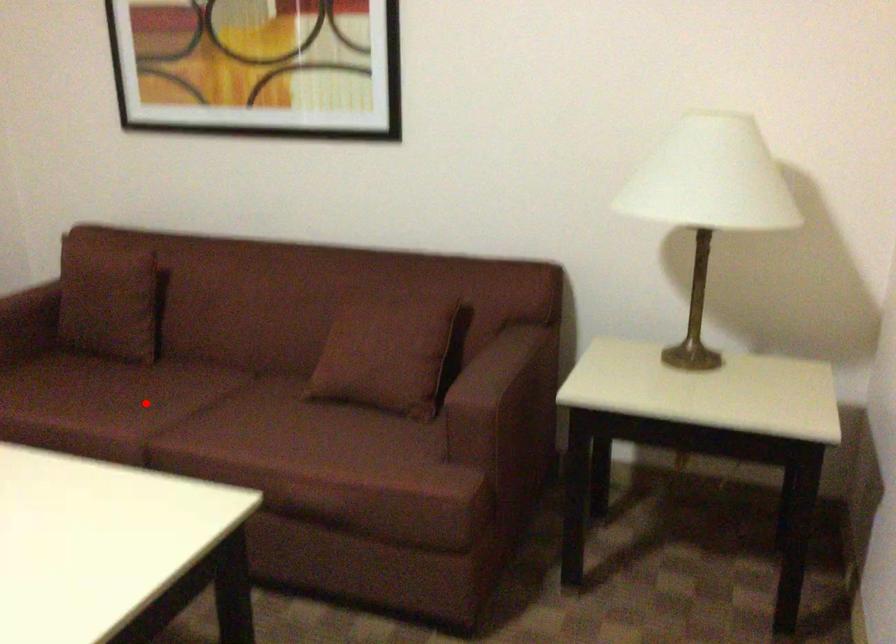
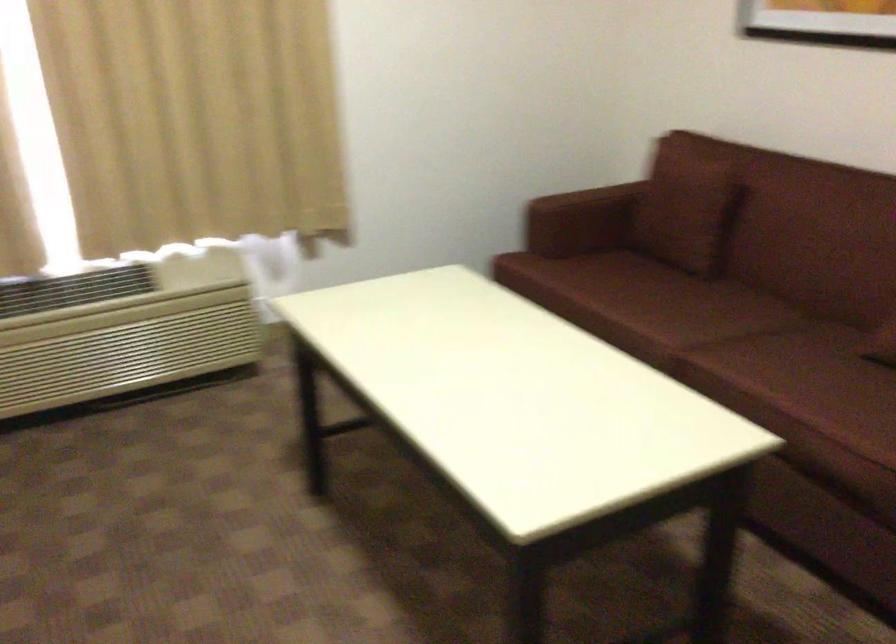
The point at the highlighted location is marked in the first image. Where is the corresponding point in the second image?

(682, 310)